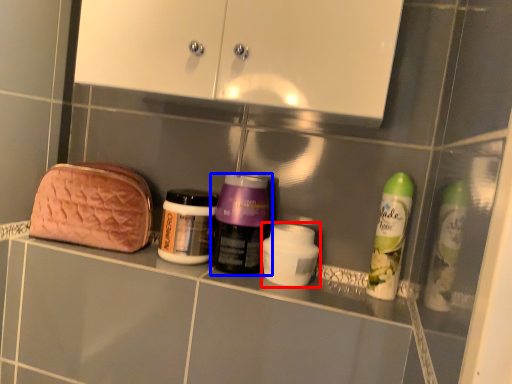
Question: Which object appears closest to the camera in this image, toiletry (highlighted by a red box) or bottle (highlighted by a blue box)?

Choices:
 (A) toiletry
 (B) bottle

Answer: (A)